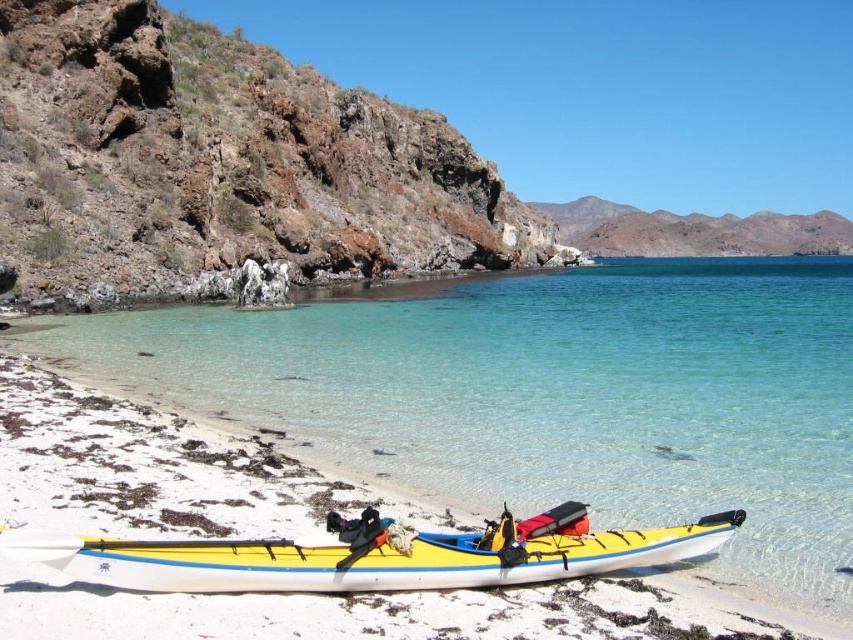
You are planning to take a photo of the yellow matte kayak at lower center and the rusty rock at upper left for a travel blog. Since you want both objects to be clearly visible in the frame, which object should you focus on first to ensure proper depth of field?

The rusty rock at upper left is taller than the yellow matte kayak at lower center, so you should focus on the rusty rock at upper left first to ensure both are in focus.

You are standing on the sandy beach and want to reach the clear water at lower center. According to the coordinates provided, in which direction should you walk from your current position on the beach?

The clear water at lower center is located at coordinates point (554, 396). Since you are on the beach, you should walk towards the lower center direction to reach the clear water at lower center.

You are standing on the beach looking at the yellow and white kayak. There is a point marked at coordinates (554,396). What is located at that point?

The point at coordinates (554,396) marks clear water at lower center.